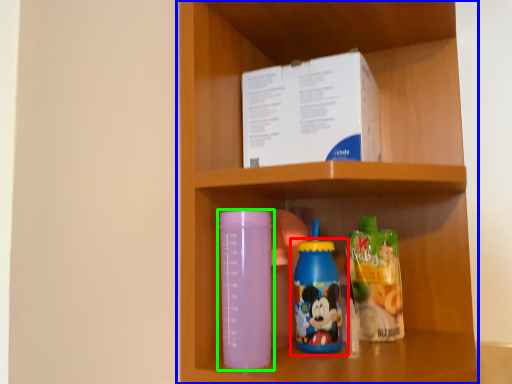
Question: Considering the real-world distances, which object is closest to bottle (highlighted by a red box)? shelf (highlighted by a blue box) or bottle (highlighted by a green box).

Choices:
 (A) shelf
 (B) bottle

Answer: (B)